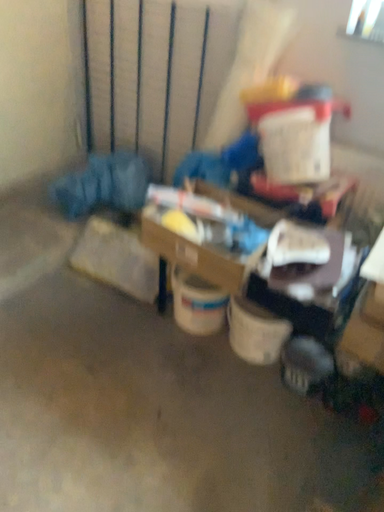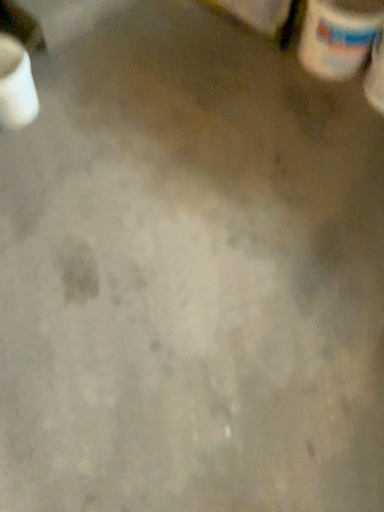
Question: How did the camera likely rotate when shooting the video?

Choices:
 (A) rotated downward
 (B) rotated upward

Answer: (A)